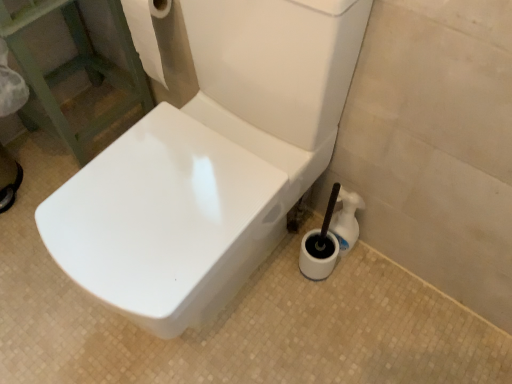
Question: Can you confirm if white glossy toilet brush at lower right is taller than white glossy toilet at center?

Choices:
 (A) no
 (B) yes

Answer: (A)

Question: From the image's perspective, would you say white glossy toilet brush at lower right is shown under white glossy toilet at center?

Choices:
 (A) yes
 (B) no

Answer: (A)

Question: Is white glossy toilet brush at lower right outside white glossy toilet at center?

Choices:
 (A) yes
 (B) no

Answer: (A)

Question: Is white glossy toilet brush at lower right surrounding white glossy toilet at center?

Choices:
 (A) no
 (B) yes

Answer: (A)

Question: Is white glossy toilet brush at lower right smaller than white glossy toilet at center?

Choices:
 (A) yes
 (B) no

Answer: (A)

Question: Considering the positions of white paper towel at upper left and white glossy toilet brush at lower right in the image, is white paper towel at upper left bigger or smaller than white glossy toilet brush at lower right?

Choices:
 (A) small
 (B) big

Answer: (B)

Question: Is white paper towel at upper left inside or outside of white glossy toilet brush at lower right?

Choices:
 (A) inside
 (B) outside

Answer: (B)

Question: From the image's perspective, relative to white glossy toilet brush at lower right, is white paper towel at upper left above or below?

Choices:
 (A) above
 (B) below

Answer: (A)

Question: Considering the positions of white paper towel at upper left and white glossy toilet brush at lower right in the image, is white paper towel at upper left taller or shorter than white glossy toilet brush at lower right?

Choices:
 (A) tall
 (B) short

Answer: (A)

Question: Considering the positions of white glossy toilet at center and white paper towel at upper left in the image, is white glossy toilet at center taller or shorter than white paper towel at upper left?

Choices:
 (A) tall
 (B) short

Answer: (A)

Question: Is white glossy toilet at center situated inside white paper towel at upper left or outside?

Choices:
 (A) inside
 (B) outside

Answer: (B)

Question: Is point (174, 140) positioned closer to the camera than point (153, 44)?

Choices:
 (A) farther
 (B) closer

Answer: (B)

Question: Considering the relative positions of white glossy toilet at center and white paper towel at upper left in the image provided, is white glossy toilet at center to the left or to the right of white paper towel at upper left?

Choices:
 (A) left
 (B) right

Answer: (B)

Question: Considering the positions of white glossy toilet brush at lower right and white glossy toilet at center in the image, is white glossy toilet brush at lower right taller or shorter than white glossy toilet at center?

Choices:
 (A) tall
 (B) short

Answer: (B)

Question: Looking at their shapes, would you say white glossy toilet brush at lower right is wider or thinner than white glossy toilet at center?

Choices:
 (A) wide
 (B) thin

Answer: (B)